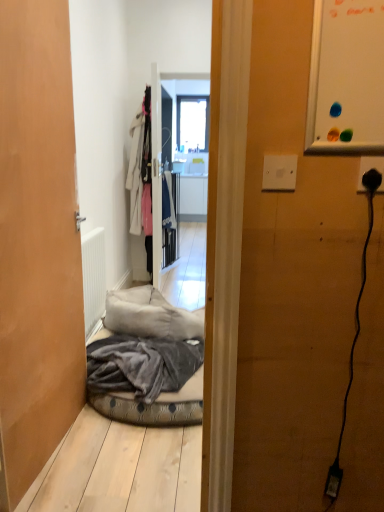
Identify the location of vacant area situated below wooden door at left (from a real-world perspective). Image resolution: width=384 pixels, height=512 pixels. (x=60, y=450).